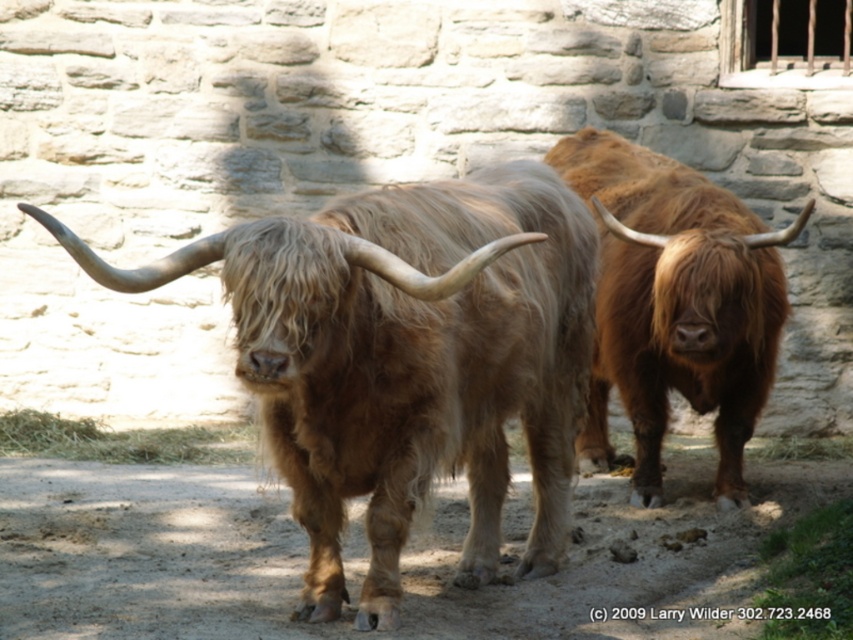
Who is shorter, fuzzy brown yak at center or brown fuzzy bull at center?

Standing shorter between the two is fuzzy brown yak at center.

Does fuzzy brown yak at center appear on the left side of brown fuzzy bull at center?

Yes, fuzzy brown yak at center is to the left of brown fuzzy bull at center.

Is point (582, 392) closer to camera compared to point (616, 228)?

Yes.

You are a GUI agent. You are given a task and a screenshot of the screen. Output one action in this format:
    pyautogui.click(x=<x>, y=<y>)
    Task: Click on the fuzzy brown yak at center
    
    Given the screenshot: What is the action you would take?
    pyautogui.click(x=405, y=358)